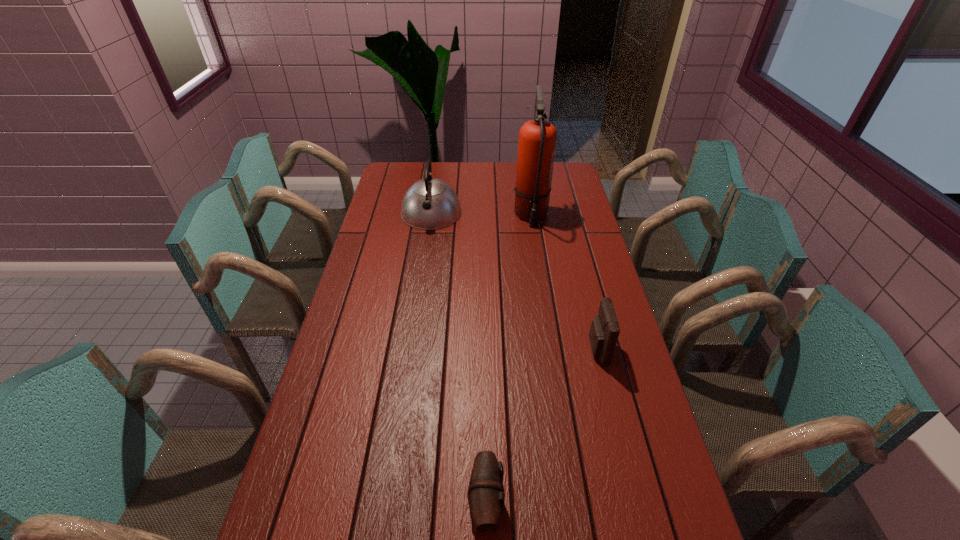
Where is `fire extinguisher`? fire extinguisher is located at coordinates (537, 138).

Locate an element on the screen. The height and width of the screenshot is (540, 960). the tallest object is located at coordinates (537, 138).

I want to click on the second tallest object, so click(430, 203).

Find the location of a particular element. kettle is located at coordinates (430, 203).

Where is `the third farthest object`? The image size is (960, 540). the third farthest object is located at coordinates (604, 331).

The width and height of the screenshot is (960, 540). Identify the location of the right pouch. (604, 331).

Identify the location of vacant space located 0.350m on the nozzle of the second object from right to left. The width and height of the screenshot is (960, 540). (543, 295).

In order to click on vacant space located 0.100m from the spout of the leftmost object in this screenshot , I will do `click(426, 248)`.

The width and height of the screenshot is (960, 540). In order to click on blank space located with an open flap on the farther pouch in this screenshot , I will do `click(537, 349)`.

I want to click on vacant space located 0.390m with an open flap on the farther pouch, so click(x=455, y=349).